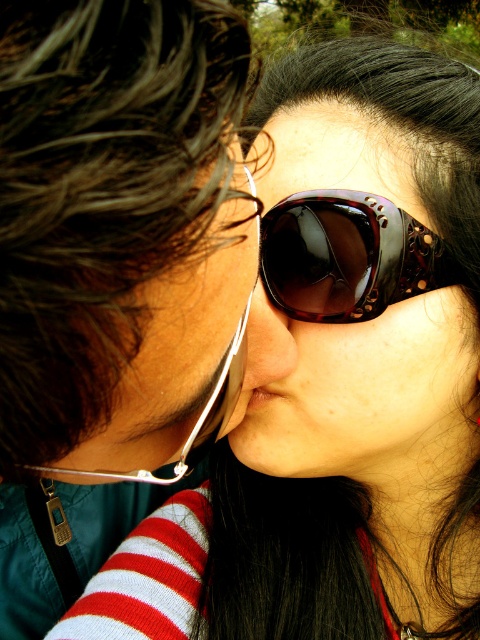
Between shiny tortoiseshell sunglasses at center and matte black nose at center, which one appears on the right side from the viewer's perspective?

From the viewer's perspective, shiny tortoiseshell sunglasses at center appears more on the right side.

Is point (395, 276) farther from viewer compared to point (274, 349)?

Yes, it is behind point (274, 349).

This screenshot has width=480, height=640. I want to click on shiny tortoiseshell sunglasses at center, so click(347, 256).

Can you confirm if sunglasses at center is shorter than shiny tortoiseshell sunglasses at center?

Incorrect, sunglasses at center's height does not fall short of shiny tortoiseshell sunglasses at center's.

Can you confirm if sunglasses at center is positioned to the left of shiny tortoiseshell sunglasses at center?

Incorrect, sunglasses at center is not on the left side of shiny tortoiseshell sunglasses at center.

What do you see at coordinates (365, 394) in the screenshot? I see `sunglasses at center` at bounding box center [365, 394].

Where is `sunglasses at center`? Image resolution: width=480 pixels, height=640 pixels. sunglasses at center is located at coordinates (365, 394).

Who is more distant from viewer, (231, 154) or (321, 237)?

Positioned behind is point (321, 237).

Is sunglasses at left smaller than shiny tortoiseshell sunglasses at center?

No.

You are a GUI agent. You are given a task and a screenshot of the screen. Output one action in this format:
    pyautogui.click(x=<x>, y=<y>)
    Task: Click on the sunglasses at left
    
    Given the screenshot: What is the action you would take?
    (x=177, y=353)